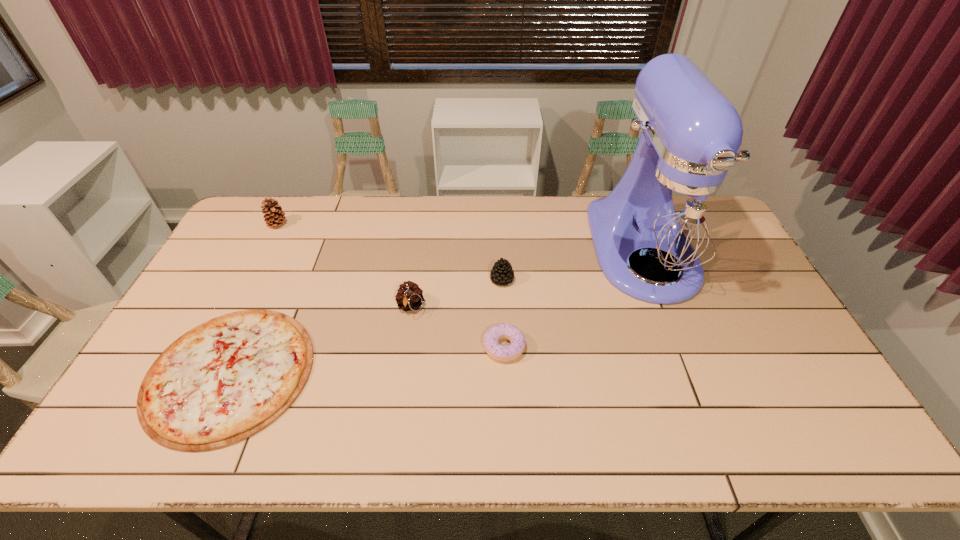
Identify the location of mixer. This screenshot has width=960, height=540. (674, 213).

You are a GUI agent. You are given a task and a screenshot of the screen. Output one action in this format:
    pyautogui.click(x=<x>, y=<y>)
    Task: Click on the tallest object
    The image size is (960, 540).
    Given the screenshot: What is the action you would take?
    pyautogui.click(x=674, y=213)

What are the coordinates of `the leftmost pinecone` in the screenshot? It's located at (274, 215).

Image resolution: width=960 pixels, height=540 pixels. In order to click on the farthest pinecone in this screenshot , I will do `click(274, 215)`.

Identify the location of the nearest pinecone. The width and height of the screenshot is (960, 540). (410, 297).

Identify the location of the third object from left to right. (410, 297).

Locate an element on the screen. The height and width of the screenshot is (540, 960). the second farthest pinecone is located at coordinates (502, 273).

Where is `the second shortest object`? The height and width of the screenshot is (540, 960). the second shortest object is located at coordinates (499, 352).

The height and width of the screenshot is (540, 960). I want to click on pizza, so click(x=223, y=381).

Identify the location of free space located 0.210m at the mixing area of the mixer. (694, 380).